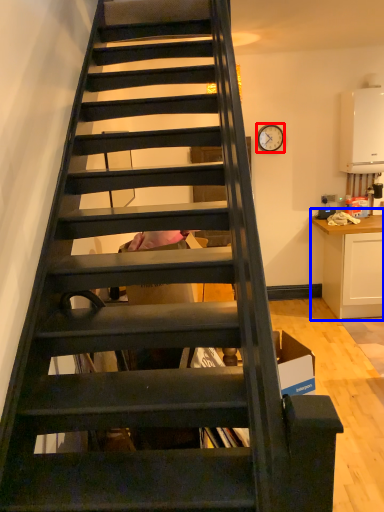
Question: Which point is further to the camera, clock (highlighted by a red box) or cabinetry (highlighted by a blue box)?

Choices:
 (A) clock
 (B) cabinetry

Answer: (A)